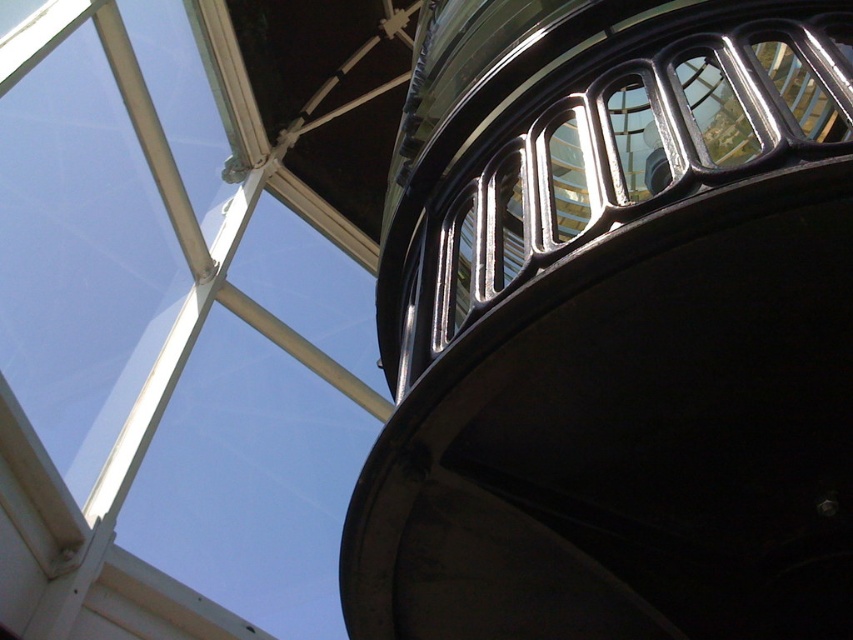
Question: Which point appears closest to the camera in this image?

Choices:
 (A) (321, 556)
 (B) (764, 524)

Answer: (B)

Question: Can you confirm if glossy metal tower at upper center is thinner than transparent glass window at upper left?

Choices:
 (A) yes
 (B) no

Answer: (B)

Question: Which of the following is the closest to the observer?

Choices:
 (A) (195, 36)
 (B) (546, 387)

Answer: (B)

Question: Does glossy metal tower at upper center have a greater width compared to transparent glass window at upper left?

Choices:
 (A) yes
 (B) no

Answer: (A)

Question: Is glossy metal tower at upper center smaller than transparent glass window at upper left?

Choices:
 (A) no
 (B) yes

Answer: (B)

Question: Which of the following is the farthest from the observer?

Choices:
 (A) (160, 205)
 (B) (727, 106)

Answer: (A)